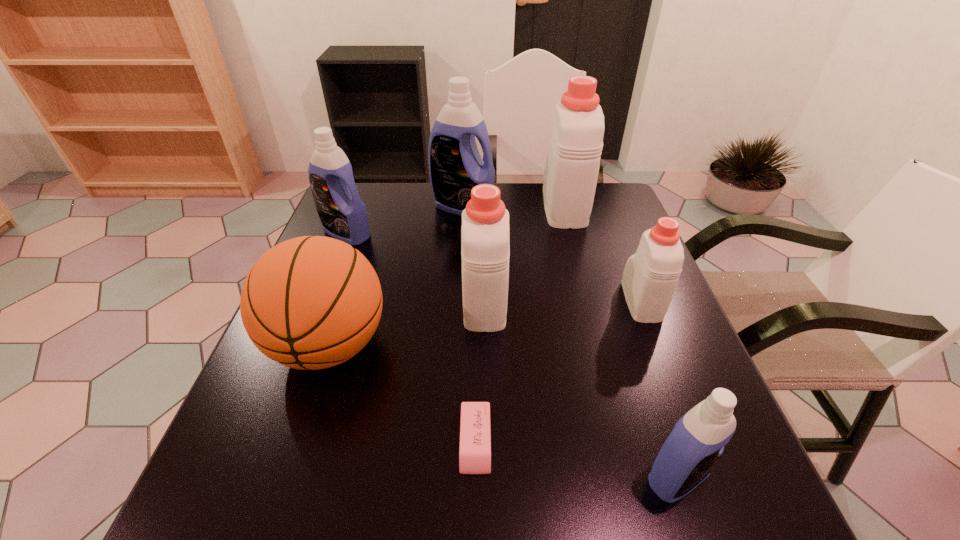
At what (x,y) coordinates should I click in order to perform the action: click on blank area located on the handle side of the rightmost white detergent. Please return your answer as a coordinate pair (x, y). The height and width of the screenshot is (540, 960). Looking at the image, I should click on (617, 240).

Where is `vacant space located 0.240m on the back of the nearest blue detergent`? This screenshot has width=960, height=540. vacant space located 0.240m on the back of the nearest blue detergent is located at coordinates 632,343.

This screenshot has height=540, width=960. Find the location of `free space located 0.050m on the left of the pink eraser`. free space located 0.050m on the left of the pink eraser is located at coordinates (432, 442).

This screenshot has height=540, width=960. What are the coordinates of `object present at the near edge` in the screenshot? It's located at (697, 441).

The height and width of the screenshot is (540, 960). In order to click on detergent present at the left edge in this screenshot , I will do `click(343, 215)`.

Locate an element on the screen. basketball that is at the left edge is located at coordinates (312, 302).

At what (x,y) coordinates should I click in order to perform the action: click on object that is at the far left corner. Please return your answer as a coordinate pair (x, y). The image size is (960, 540). Looking at the image, I should click on (343, 215).

Locate an element on the screen. This screenshot has width=960, height=540. object that is at the far right corner is located at coordinates (571, 171).

Locate an element on the screen. The image size is (960, 540). object situated at the near right corner is located at coordinates (697, 441).

Locate an element on the screen. This screenshot has width=960, height=540. free space at the far edge of the desktop is located at coordinates (403, 220).